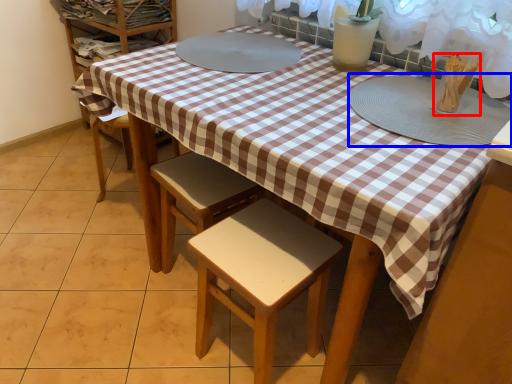
Question: Among these objects, which one is nearest to the camera, tableware (highlighted by a red box) or platter (highlighted by a blue box)?

Choices:
 (A) tableware
 (B) platter

Answer: (B)